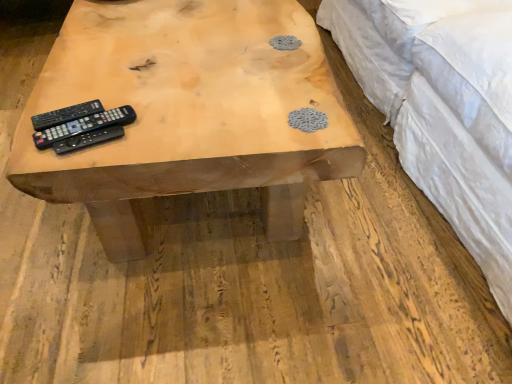
Identify the location of vacant space behind black matte remote control at center, which appears as the first remote control when viewed from the front. The height and width of the screenshot is (384, 512). (114, 87).